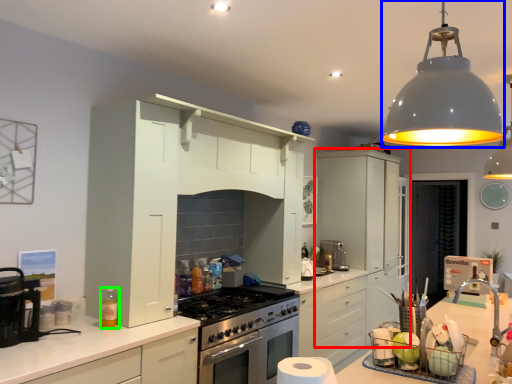
Question: Considering the real-world distances, which object is closest to cabinetry (highlighted by a red box)? light fixture (highlighted by a blue box) or bottle (highlighted by a green box).

Choices:
 (A) light fixture
 (B) bottle

Answer: (B)